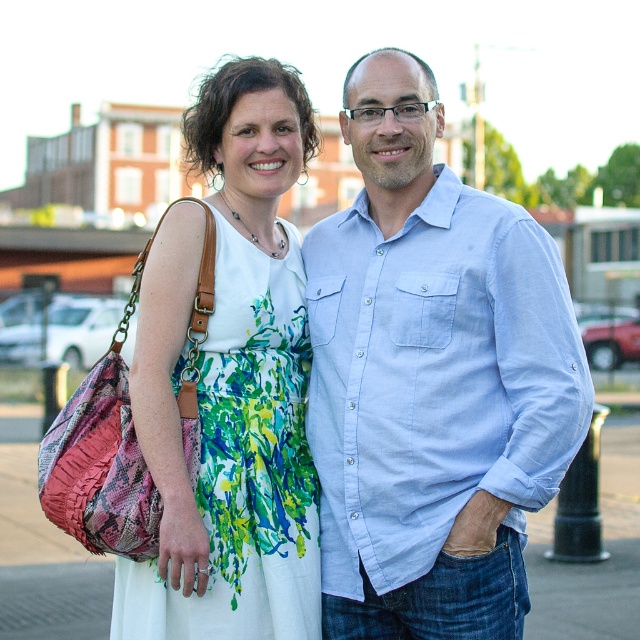
You are a photographer setting up a backdrop for a photoshoot. You have a limited space that can only accommodate clothing items with a maximum width of 40 inches. You need to decide whether both the light blue denim shirt at center and the floral print fabric dress at center can fit side by side on the backdrop. Based on their widths, can they both fit?

The light blue denim shirt at center is wider than the floral print fabric dress at center. Since the shirt is already wider than the dress, but the total combined width of both items would depend on their individual measurements. However, the description only states the shirt is wider, not the exact dimensions. Without knowing the exact widths, it is impossible to determine if they can both fit within the 40 inch limit.

You are a photographer trying to position your camera to capture the light blue denim shirt at center. What are the coordinates you should aim for?

The coordinates to aim for are 0.592 on the x axis and 0.675 on the y axis.

You are a photographer setting up for a group photo. You notice the light blue denim shirt at center and the floral print fabric dress at center. Which clothing item is positioned higher in the frame?

The light blue denim shirt at center is positioned higher in the frame than the floral print fabric dress at center, as it is described to be above it.